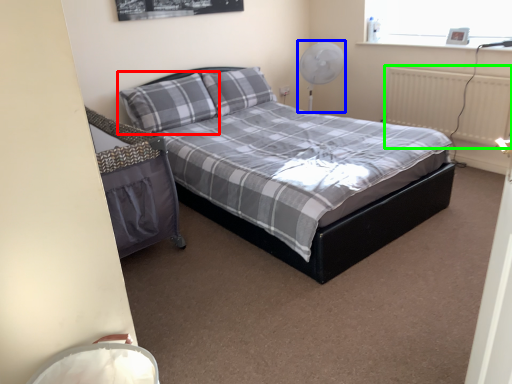
Question: Which object is the closest to the pillow (highlighted by a red box)? Choose among these: fan (highlighted by a blue box) or radiator (highlighted by a green box).

Choices:
 (A) fan
 (B) radiator

Answer: (A)